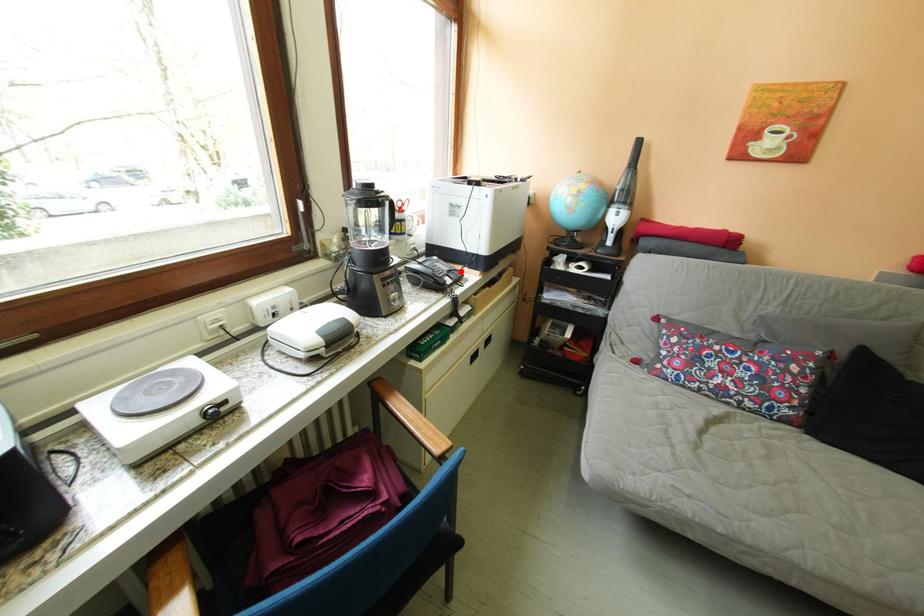
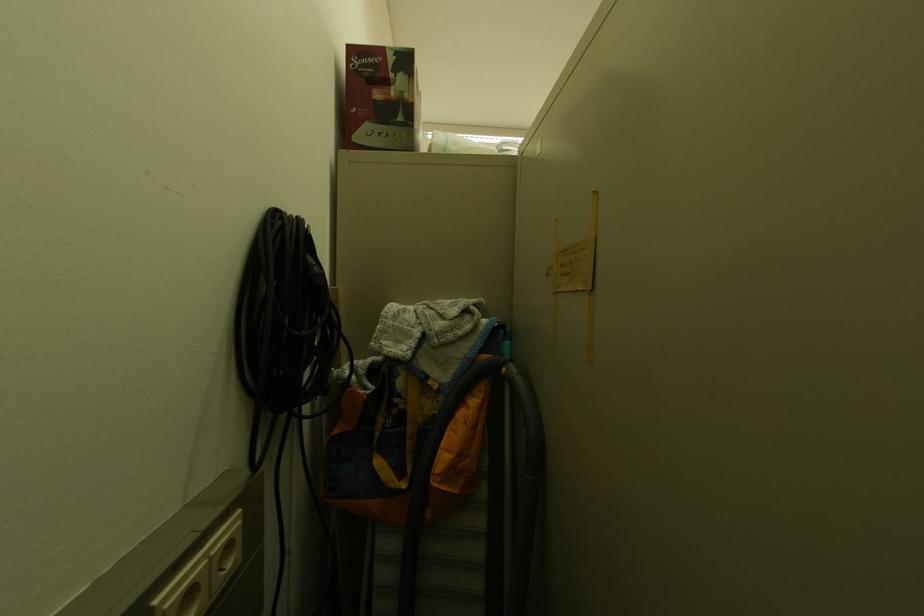
Question: I am providing you with two images of the same scene from different viewpoints. A red point is marked on the first image. At the location where the point appears in image 1, is it still visible in image 2?

Choices:
 (A) Yes
 (B) No

Answer: (B)